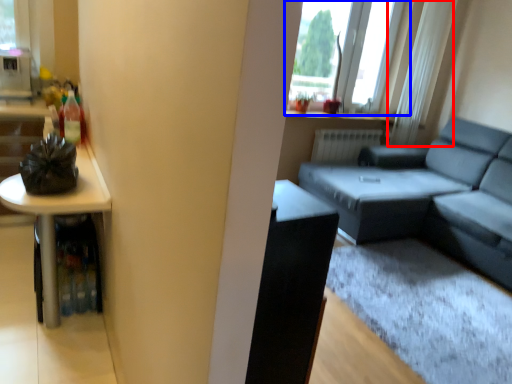
Question: Which object appears farthest to the camera in this image, curtain (highlighted by a red box) or window (highlighted by a blue box)?

Choices:
 (A) curtain
 (B) window

Answer: (A)